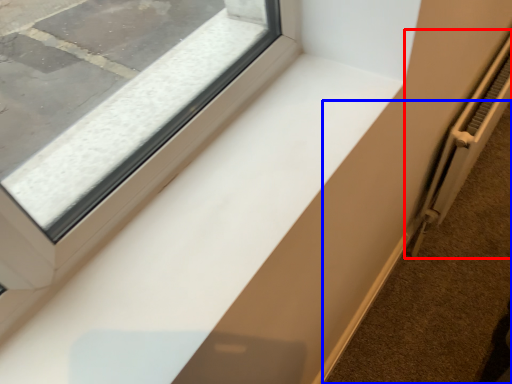
Question: Which point is closer to the camera, radiator (highlighted by a red box) or pavement (highlighted by a blue box)?

Choices:
 (A) radiator
 (B) pavement

Answer: (A)